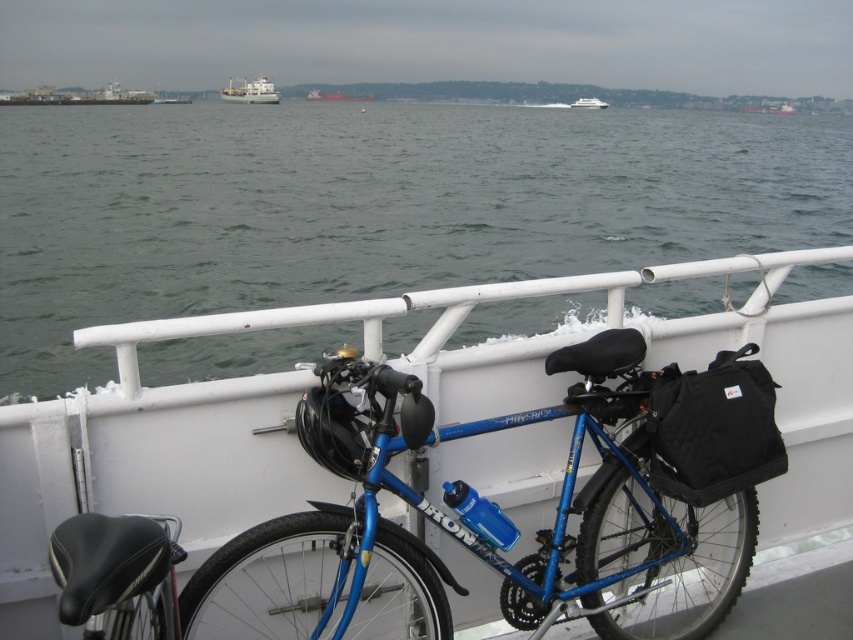
Question: Estimate the real-world distances between objects in this image. Which object is farther from the white glossy boat at upper center?

Choices:
 (A) white matte cargo ship at upper center
 (B) blue metallic bicycle at center
 (C) brown wooden boat at center
 (D) gray water at center

Answer: (B)

Question: Which of the following is the farthest from the observer?

Choices:
 (A) brown wooden boat at center
 (B) white matte cargo ship at upper center

Answer: (A)

Question: Does gray water at center appear over blue metallic bicycle at center?

Choices:
 (A) no
 (B) yes

Answer: (B)

Question: Can you confirm if gray water at center is positioned to the left of brown wooden boat at center?

Choices:
 (A) yes
 (B) no

Answer: (B)

Question: Does white matte cargo ship at upper center have a lesser width compared to brown wooden boat at center?

Choices:
 (A) yes
 (B) no

Answer: (B)

Question: Which of these objects is positioned farthest from the blue metallic bicycle at center?

Choices:
 (A) white glossy boat at upper center
 (B) brown wooden boat at center
 (C) white matte cargo ship at upper center

Answer: (C)